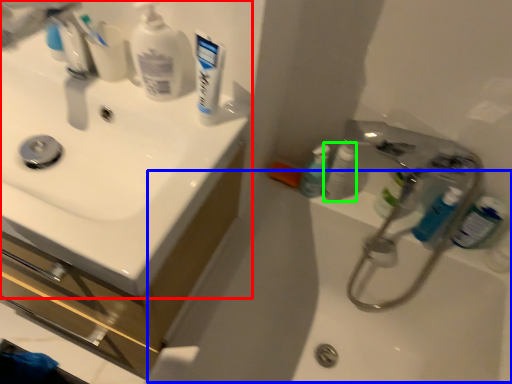
Question: Considering the real-world distances, which object is farthest from sink (highlighted by a red box)? bath (highlighted by a blue box) or toiletry (highlighted by a green box)?

Choices:
 (A) bath
 (B) toiletry

Answer: (B)